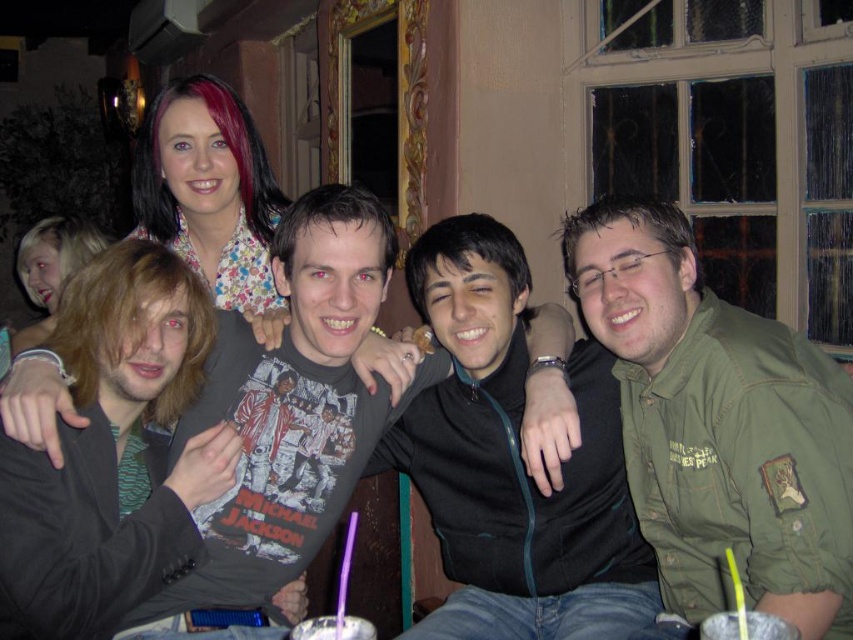
Who is higher up, black matte jacket at center or purple plastic straw at lower center?

black matte jacket at center is higher up.

How much distance is there between black matte jacket at center and purple plastic straw at lower center?

black matte jacket at center is 87.02 centimeters away from purple plastic straw at lower center.

What are the coordinates of `black matte jacket at center` in the screenshot? It's located at (514, 461).

Is dark gray t-shirt at center taller than yellow plastic straw at lower right?

Yes, dark gray t-shirt at center is taller than yellow plastic straw at lower right.

Does dark gray t-shirt at center lie in front of yellow plastic straw at lower right?

No.

What do you see at coordinates (294, 401) in the screenshot? I see `dark gray t-shirt at center` at bounding box center [294, 401].

The image size is (853, 640). I want to click on dark gray t-shirt at center, so click(x=294, y=401).

Can you confirm if green matte shirt at right is smaller than translucent plastic cup at lower center?

No, green matte shirt at right is not smaller than translucent plastic cup at lower center.

Is green matte shirt at right taller than translucent plastic cup at lower center?

Indeed, green matte shirt at right has a greater height compared to translucent plastic cup at lower center.

Is point (691, 596) positioned before point (323, 620)?

No.

You are a GUI agent. You are given a task and a screenshot of the screen. Output one action in this format:
    pyautogui.click(x=<x>, y=<y>)
    Task: Click on the green matte shirt at right
    The width and height of the screenshot is (853, 640).
    Given the screenshot: What is the action you would take?
    pyautogui.click(x=718, y=424)